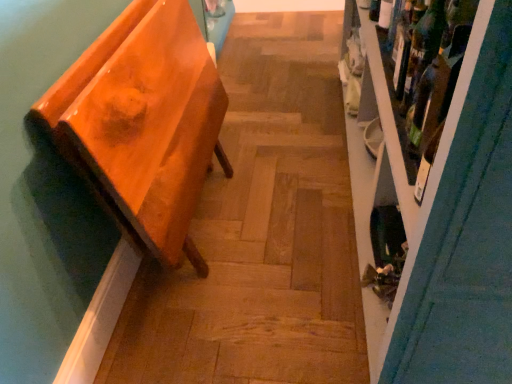
Question: Does glossy orange bench at left appear on the left side of wooden shelf at right?

Choices:
 (A) yes
 (B) no

Answer: (A)

Question: Is glossy orange bench at left closer to the viewer compared to wooden shelf at right?

Choices:
 (A) no
 (B) yes

Answer: (A)

Question: Would you say glossy orange bench at left is outside wooden shelf at right?

Choices:
 (A) yes
 (B) no

Answer: (A)

Question: Is glossy orange bench at left shorter than wooden shelf at right?

Choices:
 (A) no
 (B) yes

Answer: (B)

Question: Is glossy orange bench at left to the right of wooden shelf at right from the viewer's perspective?

Choices:
 (A) no
 (B) yes

Answer: (A)

Question: Is the position of glossy orange bench at left more distant than that of wooden shelf at right?

Choices:
 (A) no
 (B) yes

Answer: (B)

Question: From the image's perspective, is translucent glass bottle at upper right beneath green glass wine bottle at upper right?

Choices:
 (A) yes
 (B) no

Answer: (B)

Question: Does translucent glass bottle at upper right turn towards green glass wine bottle at upper right?

Choices:
 (A) yes
 (B) no

Answer: (B)

Question: Is the position of translucent glass bottle at upper right more distant than that of green glass wine bottle at upper right?

Choices:
 (A) no
 (B) yes

Answer: (B)

Question: Considering the relative sizes of translucent glass bottle at upper right and green glass wine bottle at upper right in the image provided, is translucent glass bottle at upper right bigger than green glass wine bottle at upper right?

Choices:
 (A) no
 (B) yes

Answer: (A)

Question: Is translucent glass bottle at upper right closer to the viewer compared to green glass wine bottle at upper right?

Choices:
 (A) yes
 (B) no

Answer: (B)

Question: From the image's perspective, is translucent glass bottle at upper right over green glass wine bottle at upper right?

Choices:
 (A) no
 (B) yes

Answer: (B)

Question: Could you tell me if glossy orange bench at left is facing green glass wine bottle at upper right?

Choices:
 (A) no
 (B) yes

Answer: (B)